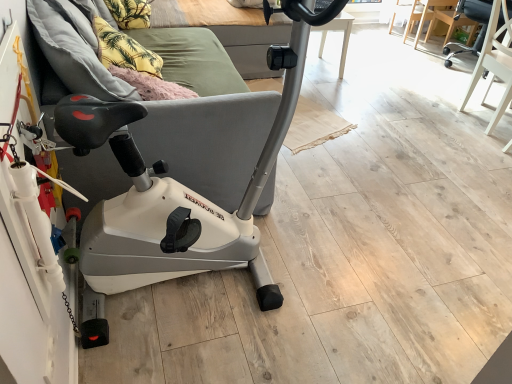
Identify the location of vacant location below white plastic stationary bicycle at left (from a real-world perspective). Image resolution: width=512 pixels, height=384 pixels. (201, 289).